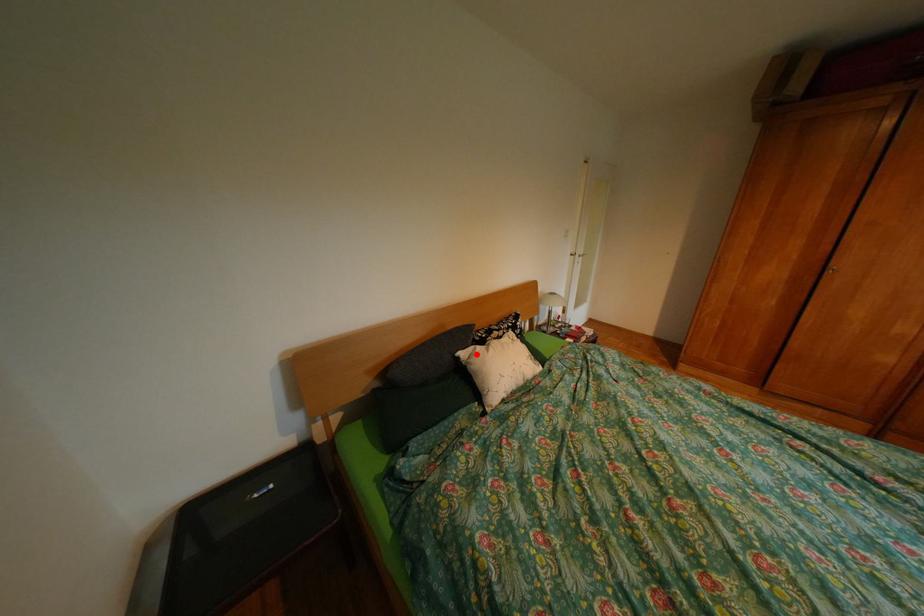
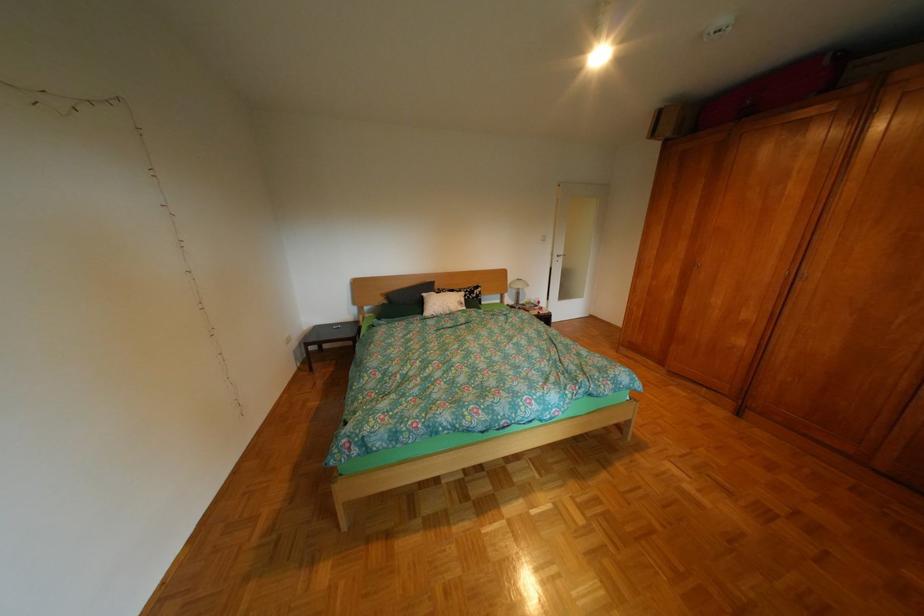
Question: I am providing you with two images of the same scene from different viewpoints. In image1, a red point is highlighted. Considering the same 3D point in image2, which of the following is correct?

Choices:
 (A) It is closer
 (B) It is farther

Answer: (A)